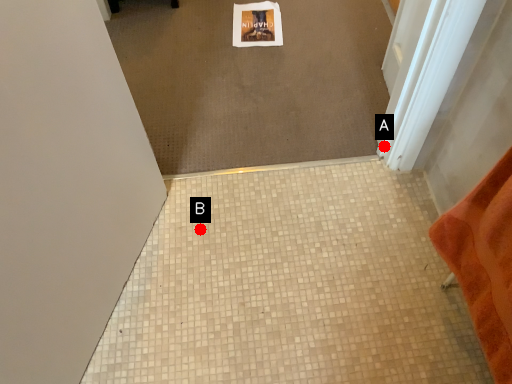
Question: Two points are circled on the image, labeled by A and B beside each circle. Which point is farther to the camera?

Choices:
 (A) A is further
 (B) B is further

Answer: (A)